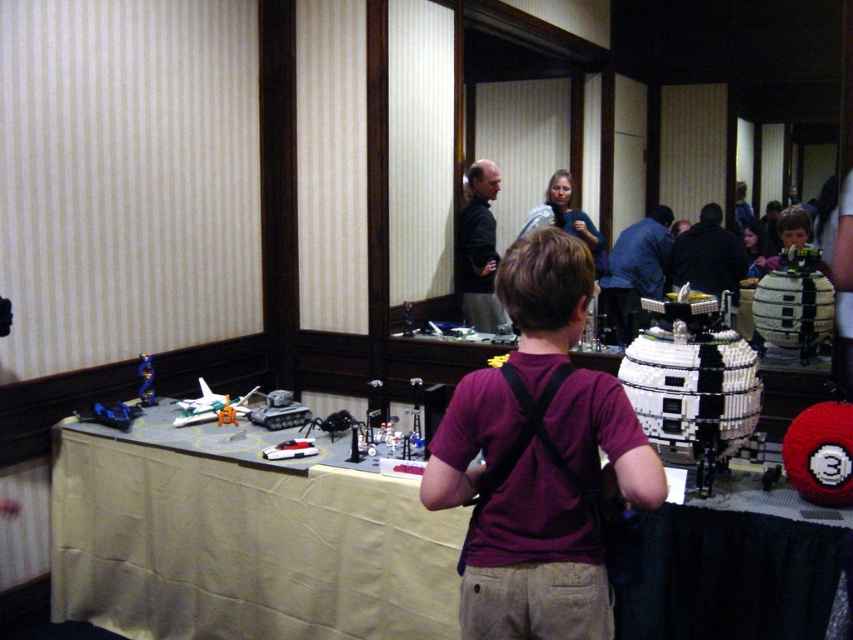
You are an event organizer checking the setup for an upcoming event. You need to place a 1.2 meter long banner on the table. Given the white fabric table at center and dark gray shirt at center, which object can accommodate the banner without folding it?

The white fabric table at center has a larger size compared to the dark gray shirt at center, so the banner can be placed on the white fabric table at center without folding.